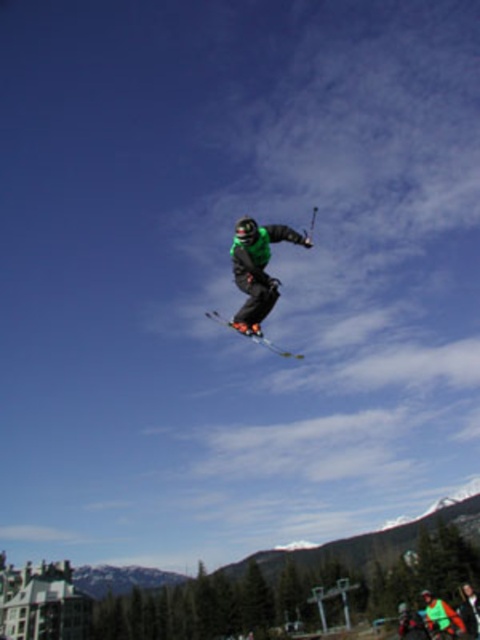
Who is lower down, green matte snowboarder at center or shiny black skis at center?

shiny black skis at center is lower down.

Is green matte snowboarder at center positioned in front of shiny black skis at center?

Yes, green matte snowboarder at center is closer to the viewer.

Is point (244, 268) positioned in front of point (243, 332)?

Yes, point (244, 268) is closer to viewer.

Image resolution: width=480 pixels, height=640 pixels. What are the coordinates of `green matte snowboarder at center` in the screenshot? It's located at (257, 268).